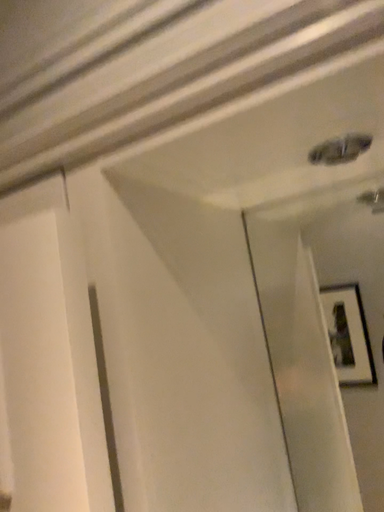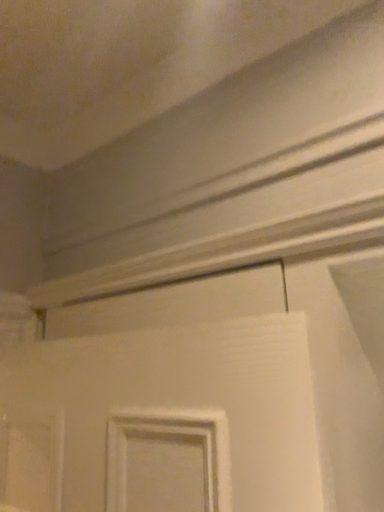
Question: Which way did the camera rotate in the video?

Choices:
 (A) rotated left
 (B) rotated right

Answer: (A)